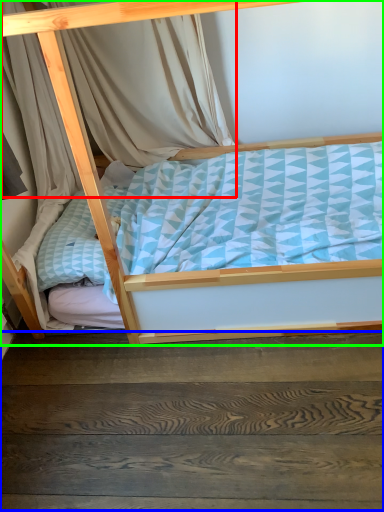
Question: Estimate the real-world distances between objects in this image. Which object is closer to curtain (highlighted by a red box), stairwell (highlighted by a blue box) or bed (highlighted by a green box)?

Choices:
 (A) stairwell
 (B) bed

Answer: (B)